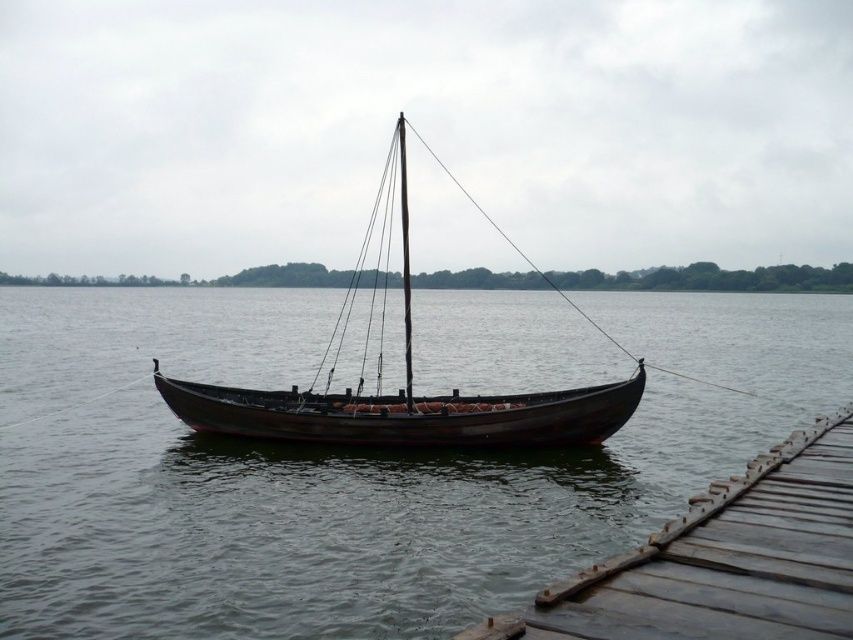
You are standing at the point labeled as point (724,560) in the image. What object is located at this exact coordinate?

The wooden planks at lower right are located at point (724,560).